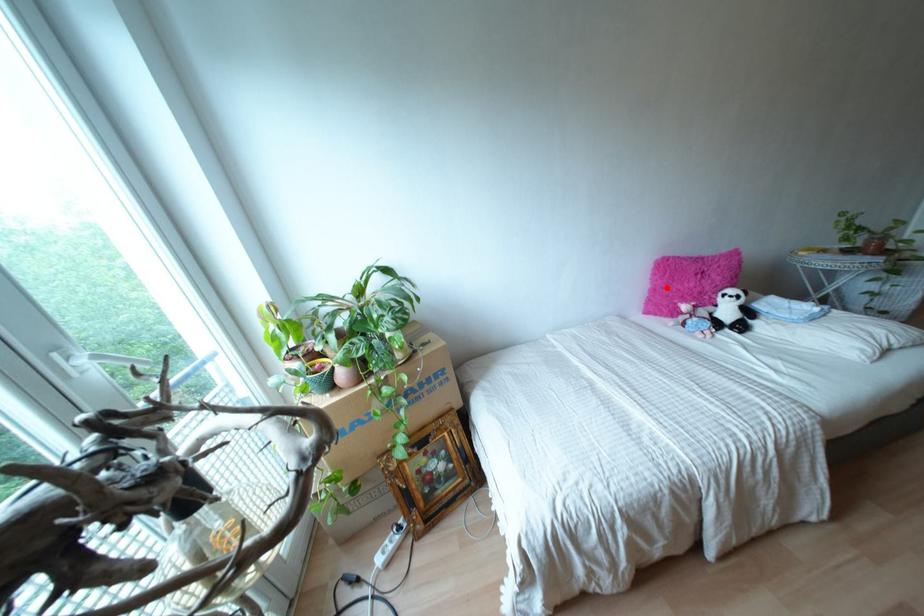
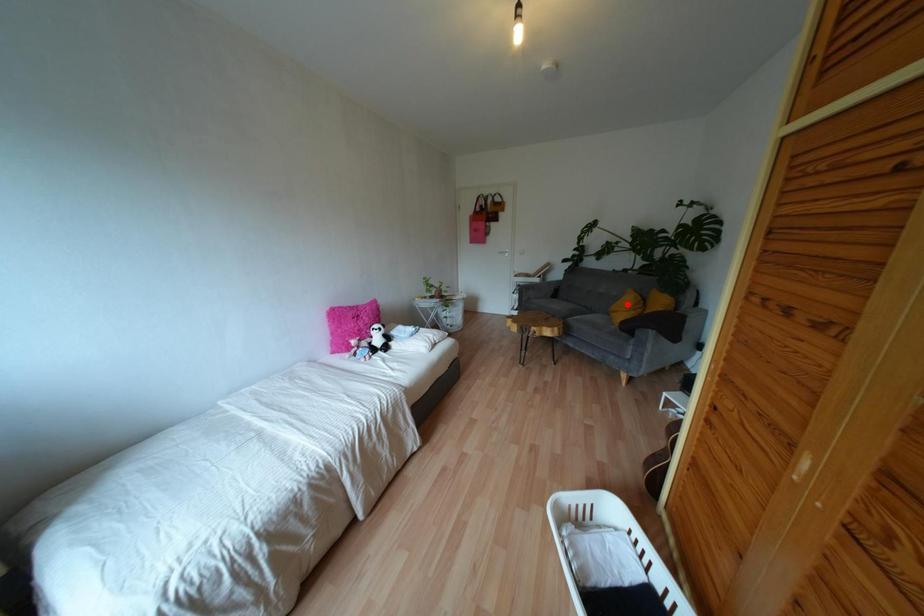
I am providing you with two images of the same scene from different viewpoints. A red point is marked on the first image and another point is marked on the second image. Do the highlighted points in image1 and image2 indicate the same real-world spot?

No